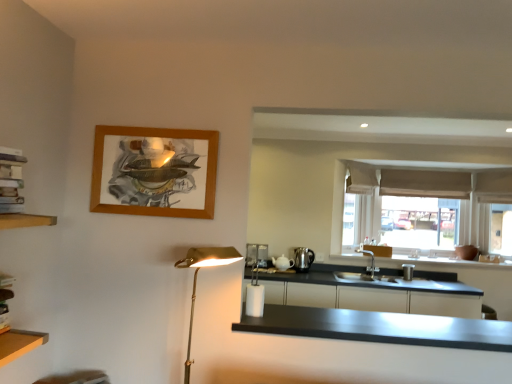
Question: Is beige fabric window at center to the left of gold metallic floor lamp at left from the viewer's perspective?

Choices:
 (A) yes
 (B) no

Answer: (B)

Question: Can you confirm if beige fabric window at center is shorter than gold metallic floor lamp at left?

Choices:
 (A) no
 (B) yes

Answer: (A)

Question: Is beige fabric window at center bigger than gold metallic floor lamp at left?

Choices:
 (A) yes
 (B) no

Answer: (A)

Question: Is beige fabric window at center thinner than gold metallic floor lamp at left?

Choices:
 (A) yes
 (B) no

Answer: (A)

Question: Can you confirm if beige fabric window at center is wider than gold metallic floor lamp at left?

Choices:
 (A) no
 (B) yes

Answer: (A)

Question: Is beige fabric window at center surrounding gold metallic floor lamp at left?

Choices:
 (A) no
 (B) yes

Answer: (A)

Question: Is matte black cabinetry at lower right facing away from white ceramic teapot at upper right, which is counted as the first appliance, starting from the left?

Choices:
 (A) no
 (B) yes

Answer: (A)

Question: From the image's perspective, is matte black cabinetry at lower right beneath white ceramic teapot at upper right, positioned as the 2th appliance in right-to-left order?

Choices:
 (A) no
 (B) yes

Answer: (B)

Question: Considering the relative positions of matte black cabinetry at lower right and white ceramic teapot at upper right, which is counted as the first appliance, starting from the left, in the image provided, is matte black cabinetry at lower right behind white ceramic teapot at upper right, which is counted as the first appliance, starting from the left,?

Choices:
 (A) yes
 (B) no

Answer: (B)

Question: Does matte black cabinetry at lower right have a smaller size compared to white ceramic teapot at upper right, positioned as the 2th appliance in right-to-left order?

Choices:
 (A) yes
 (B) no

Answer: (B)

Question: Considering the relative sizes of matte black cabinetry at lower right and white ceramic teapot at upper right, which is counted as the first appliance, starting from the left, in the image provided, is matte black cabinetry at lower right taller than white ceramic teapot at upper right, which is counted as the first appliance, starting from the left,?

Choices:
 (A) no
 (B) yes

Answer: (B)

Question: Considering the relative positions of matte black cabinetry at lower right and white ceramic teapot at upper right, which is counted as the first appliance, starting from the left, in the image provided, is matte black cabinetry at lower right to the left of white ceramic teapot at upper right, which is counted as the first appliance, starting from the left, from the viewer's perspective?

Choices:
 (A) no
 (B) yes

Answer: (A)

Question: Does satin silver kettle at right, which is the first appliance in right-to-left order, have a larger size compared to black matte countertop at center?

Choices:
 (A) yes
 (B) no

Answer: (B)